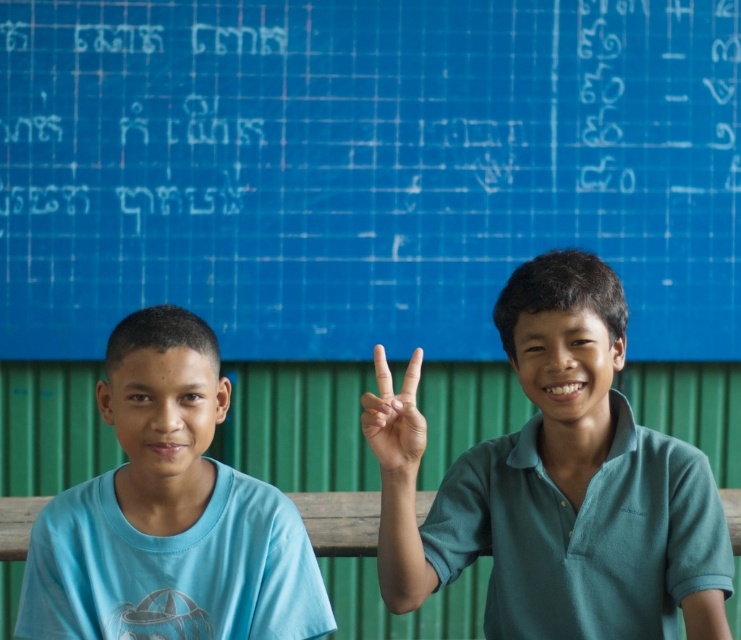
Question: In this image, where is teal matte shirt at center located relative to blue cotton shirt at left?

Choices:
 (A) below
 (B) above

Answer: (B)

Question: Can you confirm if blue cotton shirt at left is positioned to the left of smooth skin hand at center?

Choices:
 (A) yes
 (B) no

Answer: (A)

Question: Estimate the real-world distances between objects in this image. Which object is farther from the blue matte/blackboard at upper center?

Choices:
 (A) blue cotton shirt at left
 (B) teal matte shirt at center

Answer: (A)

Question: Based on their relative distances, which object is nearer to the teal matte shirt at center?

Choices:
 (A) smooth skin hand at center
 (B) blue matte/blackboard at upper center
 (C) blue cotton shirt at left

Answer: (A)

Question: Which of the following is the closest to the observer?

Choices:
 (A) (122, 353)
 (B) (682, 204)
 (C) (415, 404)

Answer: (A)

Question: Is teal matte shirt at center further to camera compared to blue cotton shirt at left?

Choices:
 (A) no
 (B) yes

Answer: (A)